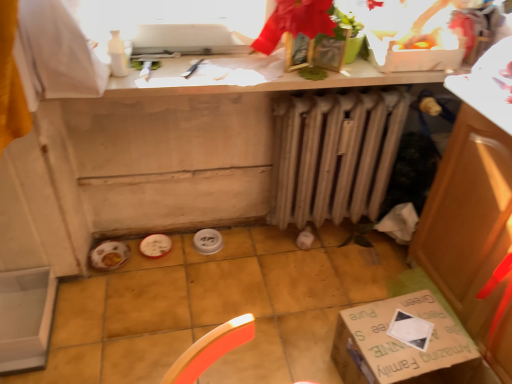
In the scene shown: What is the approximate width of white matte countertop at upper center?

10.05 inches.

Describe the element at coordinates (334, 153) in the screenshot. This screenshot has width=512, height=384. I see `beige metallic radiator at center` at that location.

Locate an element on the screen. This screenshot has height=384, width=512. white matte countertop at upper center is located at coordinates (253, 78).

Is white matte countertop at upper center bigger or smaller than white plastic box at upper center?

Clearly, white matte countertop at upper center is larger in size than white plastic box at upper center.

From the image's perspective, is white matte countertop at upper center located above or below white plastic box at upper center?

From the image's perspective, white matte countertop at upper center appears below white plastic box at upper center.

Is white matte countertop at upper center not within white plastic box at upper center?

Yes, white matte countertop at upper center is outside of white plastic box at upper center.

Is green cardboard box at lower right in contact with white plastic box at upper center?

No, green cardboard box at lower right is not in contact with white plastic box at upper center.

Locate an element on the screen. This screenshot has height=384, width=512. box behind the green cardboard box at lower right is located at coordinates (410, 56).

Would you say green cardboard box at lower right is inside or outside white plastic box at upper center?

green cardboard box at lower right is outside white plastic box at upper center.

From their relative heights in the image, would you say green cardboard box at lower right is taller or shorter than white plastic box at upper center?

In the image, green cardboard box at lower right appears to be taller than white plastic box at upper center.

Considering the positions of points (432, 70) and (308, 121), is point (432, 70) farther from camera compared to point (308, 121)?

No, it is in front of (308, 121).

Considering the sizes of objects white plastic box at upper center and beige metallic radiator at center in the image provided, who is bigger, white plastic box at upper center or beige metallic radiator at center?

Bigger between the two is beige metallic radiator at center.

Considering the relative sizes of white plastic box at upper center and beige metallic radiator at center in the image provided, is white plastic box at upper center wider than beige metallic radiator at center?

Indeed, white plastic box at upper center has a greater width compared to beige metallic radiator at center.

Who is taller, white plastic box at upper center or beige metallic radiator at center?

Standing taller between the two is beige metallic radiator at center.

Based on the photo, is white plastic box at upper center outside of white matte countertop at upper center?

Indeed, white plastic box at upper center is completely outside white matte countertop at upper center.

I want to click on countertop in front of the white plastic box at upper center, so click(x=253, y=78).

Considering the sizes of objects white plastic box at upper center and white matte countertop at upper center in the image provided, who is thinner, white plastic box at upper center or white matte countertop at upper center?

white plastic box at upper center is thinner.

Is white plastic box at upper center beside white matte countertop at upper center?

No.

Is beige metallic radiator at center facing away from white plastic box at upper center?

No, beige metallic radiator at center is not facing away from white plastic box at upper center.

Is beige metallic radiator at center located outside white plastic box at upper center?

Yes, beige metallic radiator at center is located beyond the bounds of white plastic box at upper center.

Based on the photo, is there a large distance between beige metallic radiator at center and white plastic box at upper center?

No, beige metallic radiator at center is not far from white plastic box at upper center.

This screenshot has height=384, width=512. What are the coordinates of `radiator that appears behind the green cardboard box at lower right` in the screenshot? It's located at (334, 153).

Between green cardboard box at lower right and beige metallic radiator at center, which one has larger size?

With larger size is beige metallic radiator at center.

From a real-world perspective, is green cardboard box at lower right physically located above or below beige metallic radiator at center?

green cardboard box at lower right is situated lower than beige metallic radiator at center in the real world.

Considering the relative positions of beige metallic radiator at center and green cardboard box at lower right in the image provided, is beige metallic radiator at center behind green cardboard box at lower right?

Yes, it is.

Looking at this image, between beige metallic radiator at center and green cardboard box at lower right, which one has larger size?

beige metallic radiator at center is bigger.

Is beige metallic radiator at center facing away from green cardboard box at lower right?

beige metallic radiator at center is not turned away from green cardboard box at lower right.

Is there a large distance between beige metallic radiator at center and green cardboard box at lower right?

beige metallic radiator at center is actually quite close to green cardboard box at lower right.

This screenshot has width=512, height=384. Identify the location of box behind the white matte countertop at upper center. coord(410,56).

In order to click on box located above the green cardboard box at lower right (from the image's perspective) in this screenshot , I will do `click(410, 56)`.

Based on their spatial positions, is white matte countertop at upper center or green cardboard box at lower right closer to white plastic box at upper center?

white matte countertop at upper center is positioned closer to the anchor white plastic box at upper center.

Considering their positions, is beige metallic radiator at center positioned closer to green cardboard box at lower right than white plastic box at upper center?

beige metallic radiator at center is positioned closer to the anchor green cardboard box at lower right.

From the image, which object appears to be nearer to white plastic box at upper center, green cardboard box at lower right or beige metallic radiator at center?

beige metallic radiator at center is closer to white plastic box at upper center.

Considering their positions, is beige metallic radiator at center positioned further to white plastic box at upper center than green cardboard box at lower right?

The object further to white plastic box at upper center is green cardboard box at lower right.

Looking at this image, which object lies nearer to the anchor point white matte countertop at upper center, beige metallic radiator at center or green cardboard box at lower right?

beige metallic radiator at center lies closer to white matte countertop at upper center than the other object.

Looking at the image, which one is located closer to white matte countertop at upper center, beige metallic radiator at center or white plastic box at upper center?

white plastic box at upper center lies closer to white matte countertop at upper center than the other object.

From the image, which object appears to be nearer to beige metallic radiator at center, white plastic box at upper center or green cardboard box at lower right?

The object closer to beige metallic radiator at center is white plastic box at upper center.

Based on their spatial positions, is white plastic box at upper center or green cardboard box at lower right closer to white matte countertop at upper center?

The object closer to white matte countertop at upper center is white plastic box at upper center.

Where is `radiator that lies between white plastic box at upper center and green cardboard box at lower right from top to bottom`? This screenshot has width=512, height=384. radiator that lies between white plastic box at upper center and green cardboard box at lower right from top to bottom is located at coordinates pos(334,153).

At what (x,y) coordinates should I click in order to perform the action: click on radiator between white matte countertop at upper center and white plastic box at upper center in the horizontal direction. Please return your answer as a coordinate pair (x, y). Image resolution: width=512 pixels, height=384 pixels. Looking at the image, I should click on (334, 153).

At what (x,y) coordinates should I click in order to perform the action: click on countertop between white plastic box at upper center and green cardboard box at lower right in the vertical direction. Please return your answer as a coordinate pair (x, y). The image size is (512, 384). Looking at the image, I should click on tap(253, 78).

Image resolution: width=512 pixels, height=384 pixels. I want to click on radiator between white matte countertop at upper center and green cardboard box at lower right vertically, so click(x=334, y=153).